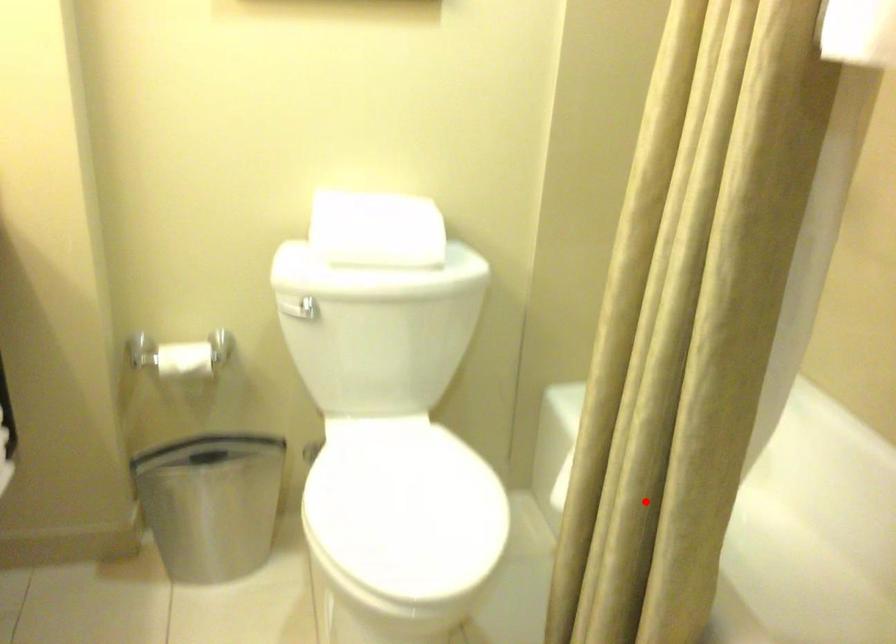
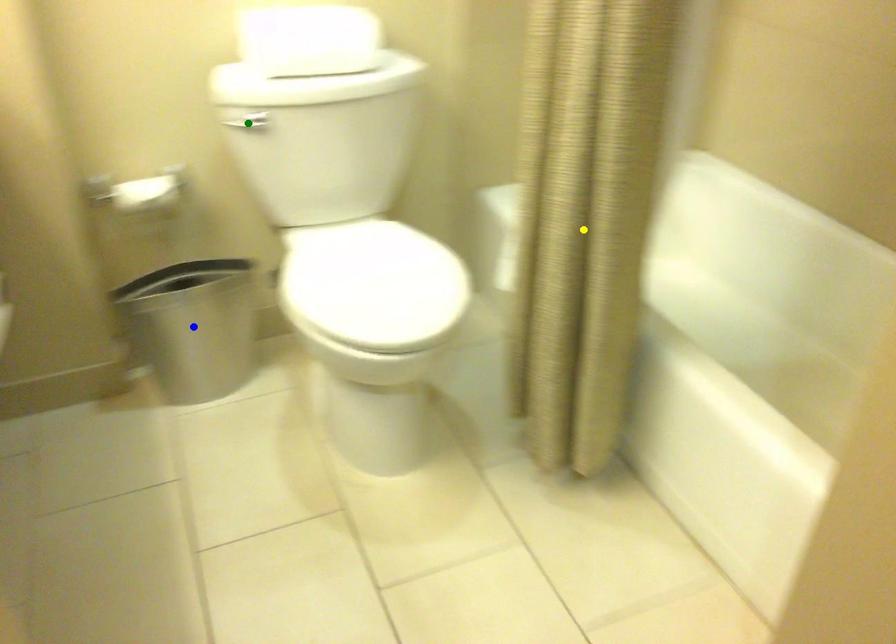
Question: I am providing you with two images of the same scene from different viewpoints. A red point is marked on the first image. You are given multiple points on the second image. Which point in image 2 is actually the same real-world point as the red point in image 1?

Choices:
 (A) yellow point
 (B) green point
 (C) blue point

Answer: (A)